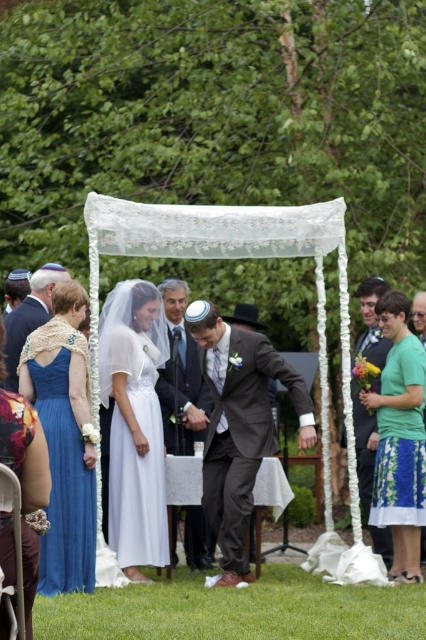
Who is higher up, white satin dress at center or matte blue dress at left?

white satin dress at center is higher up.

Does white satin dress at center appear under matte blue dress at left?

No, white satin dress at center is not below matte blue dress at left.

Who is more distant from viewer, (163, 456) or (51, 451)?

The point (163, 456) is behind.

Where is `white satin dress at center`? white satin dress at center is located at coordinates (135, 422).

In the scene shown: Who is more distant from viewer, (17, 272) or (419, 308)?

The point (17, 272) is more distant.

Where is `matte black kippah at upper left`? The height and width of the screenshot is (640, 426). matte black kippah at upper left is located at coordinates (16, 289).

Where is `matte black kippah at upper left`? matte black kippah at upper left is located at coordinates (16, 289).

Is point (400, 564) positioned before point (377, 324)?

That is True.

Which of these two, teal fabric skirt at lower right or green fabric dress at right, stands shorter?

Standing shorter between the two is teal fabric skirt at lower right.

What do you see at coordinates (400, 440) in the screenshot?
I see `teal fabric skirt at lower right` at bounding box center [400, 440].

Find the location of a particular element. The image size is (426, 640). teal fabric skirt at lower right is located at coordinates (400, 440).